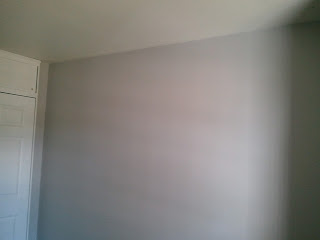
Locate an element on the screen. Image resolution: width=320 pixels, height=240 pixels. corner of wall to wall is located at coordinates (46, 98).